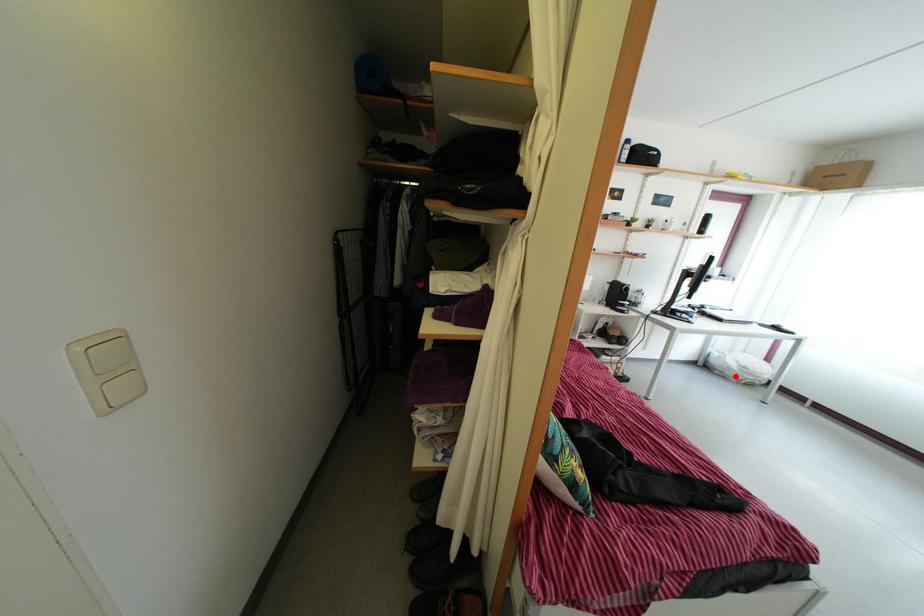
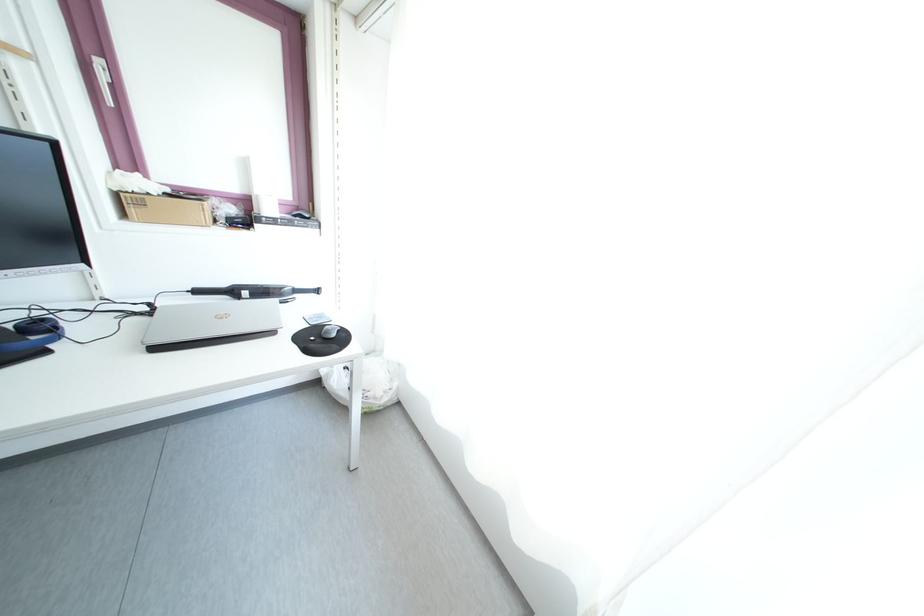
In the second image, find the point that corresponds to the highlighted location in the first image.

(344, 403)